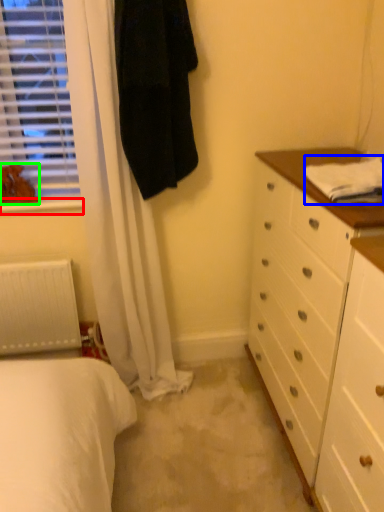
Question: Which is nearer to the window sill (highlighted by a red box)? sheet (highlighted by a blue box) or animal (highlighted by a green box).

Choices:
 (A) sheet
 (B) animal

Answer: (B)